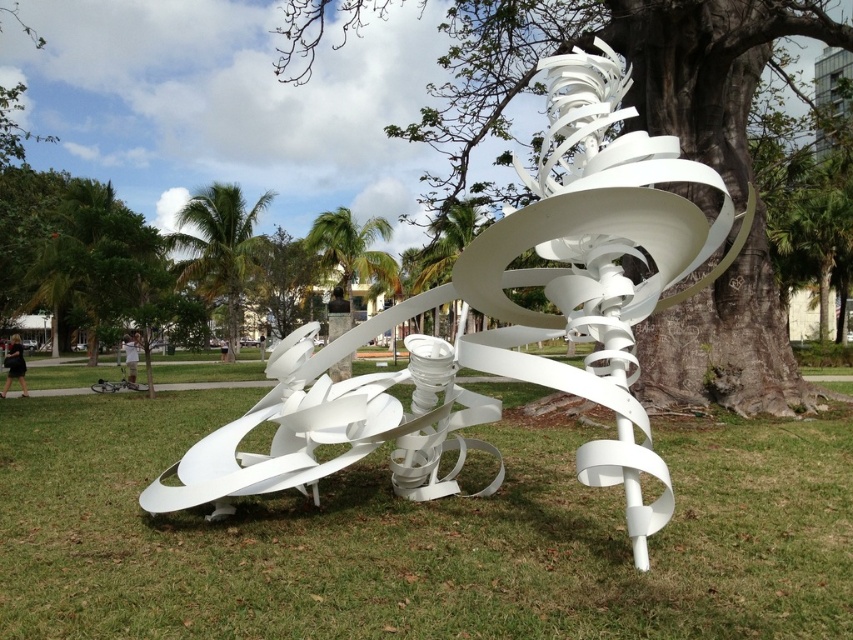
You are a gardener who wants to place a 6 feet long hose between the green grass at center and the sculpture. Is there enough space to lay the hose straight without bending it?

The distance between the green grass at center and the sculpture is 8.01 feet. Since the hose is 6 feet long, there is enough space to lay it straight without bending it.

Looking at this image, you are standing at the entrance of the park and want to locate the white matte sculpture at center. According to the coordinates provided, where should you look relative to your current position?

The white matte sculpture at center is located at coordinates point [502,320], which would be slightly above the center point in the image. Since you are at the entrance, you should look towards the central area of the park, slightly upwards or northwards depending on the park layout.

You are a photographer planning to capture the white matte sculpture at center and the green leafy palm tree at upper left in a single frame. Based on their sizes, which object should you focus on to ensure both are visible without cropping?

The white matte sculpture at center occupies less space than the green leafy palm tree at upper left, so focusing on the larger green leafy palm tree at upper left would allow both objects to fit within the frame.